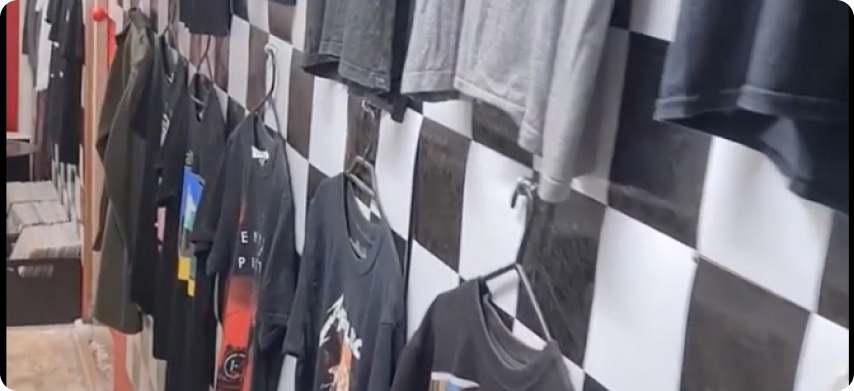
This screenshot has height=391, width=854. I want to click on back and white wall, so click(675, 289).